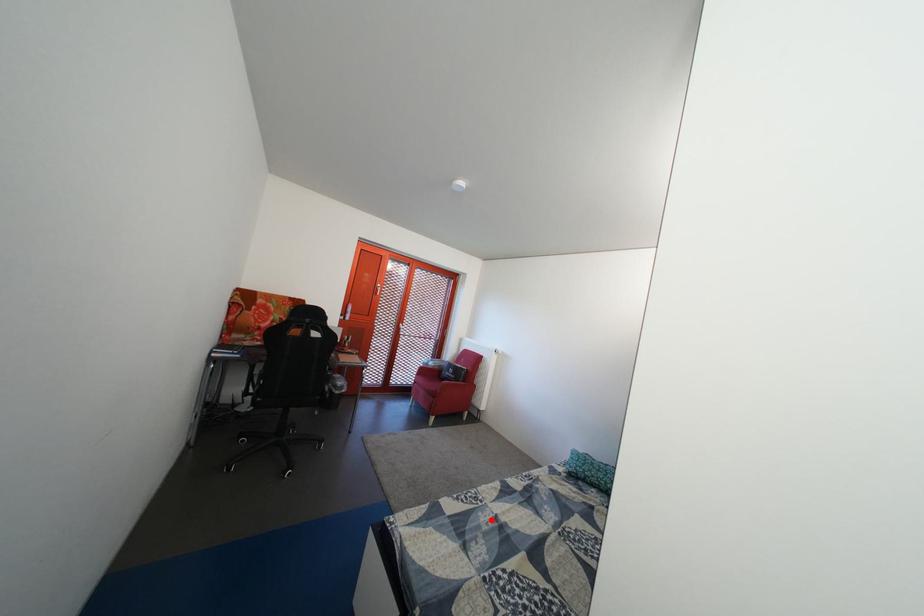
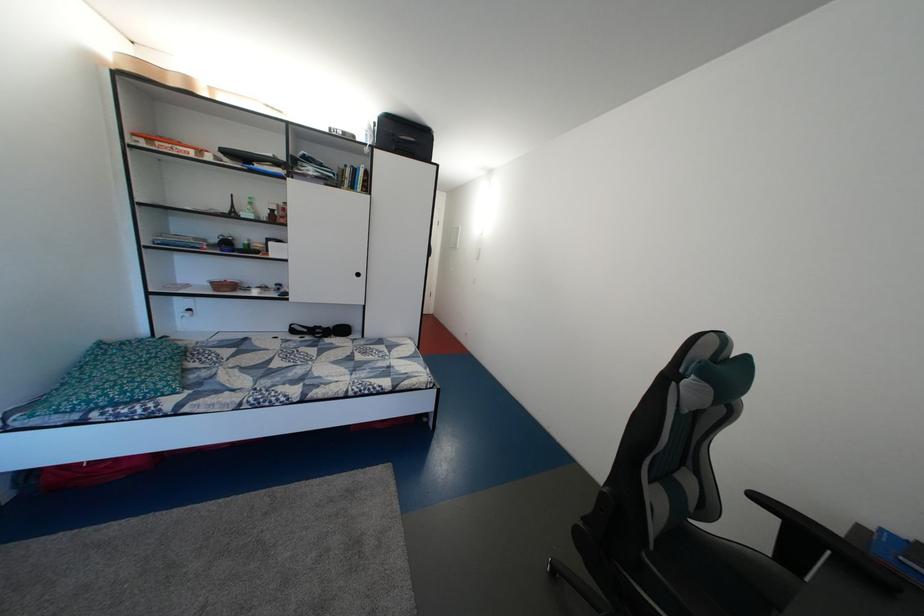
The point at the highlighted location is marked in the first image. Where is the corresponding point in the second image?

(373, 382)